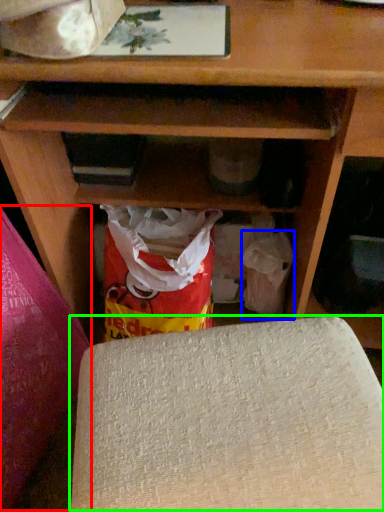
Question: Which is nearer to the yoga mat (highlighted by a red box)? grocery bag (highlighted by a blue box) or yoga mat (highlighted by a green box).

Choices:
 (A) grocery bag
 (B) yoga mat

Answer: (B)